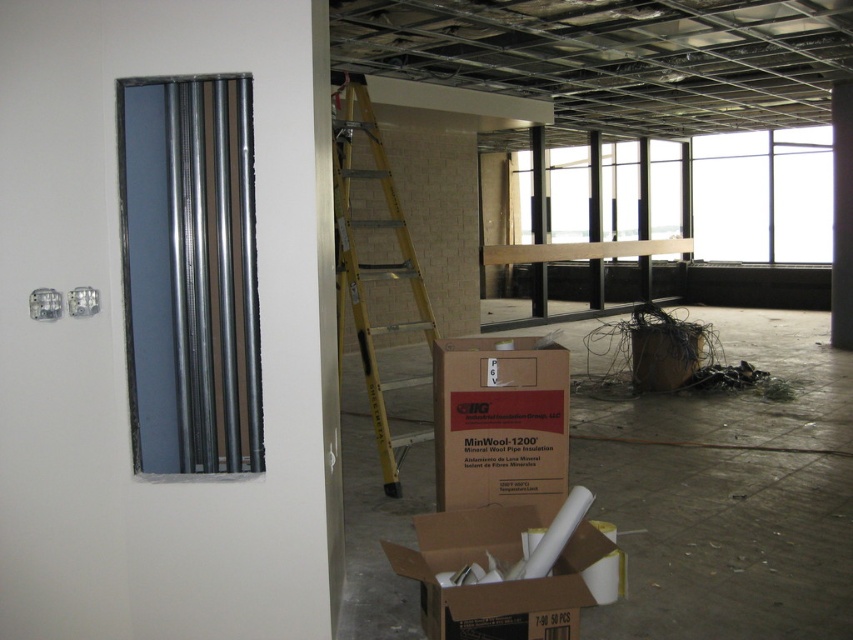
Consider the image. You are a construction worker who needs to move the yellow fiberglass ladder at center to the storage area. However, you have to step over the brown cardboard box at center first. Can you safely step over the box without touching the ladder?

The brown cardboard box at center is not as tall as the yellow fiberglass ladder at center, so stepping over the box should be safe as the ladder is taller and provides enough clearance.

You are a construction worker who needs to move the brown cardboard box at center to a different location. Which direction should you move it so it doesn not interfere with the yellow fiberglass ladder at center?

The brown cardboard box at center is below the yellow fiberglass ladder at center, so moving it to the side away from the ladder would prevent interference.